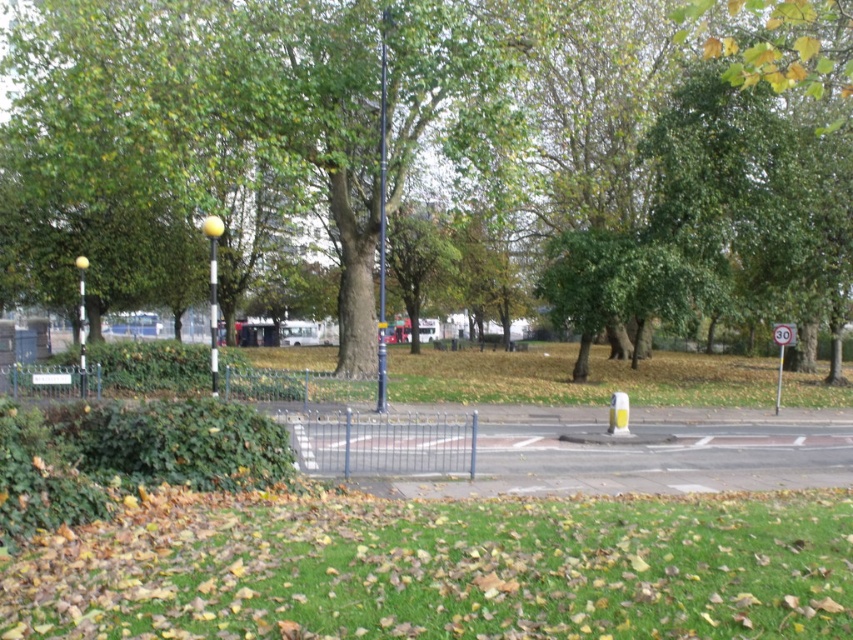
Is green leafy tree at center below green grass at lower center?

Actually, green leafy tree at center is above green grass at lower center.

The width and height of the screenshot is (853, 640). Find the location of `green leafy tree at center`. green leafy tree at center is located at coordinates (474, 132).

Is point (288, 52) in front of point (404, 636)?

No, it is not.

Locate an element on the screen. This screenshot has width=853, height=640. green leafy tree at center is located at coordinates (474, 132).